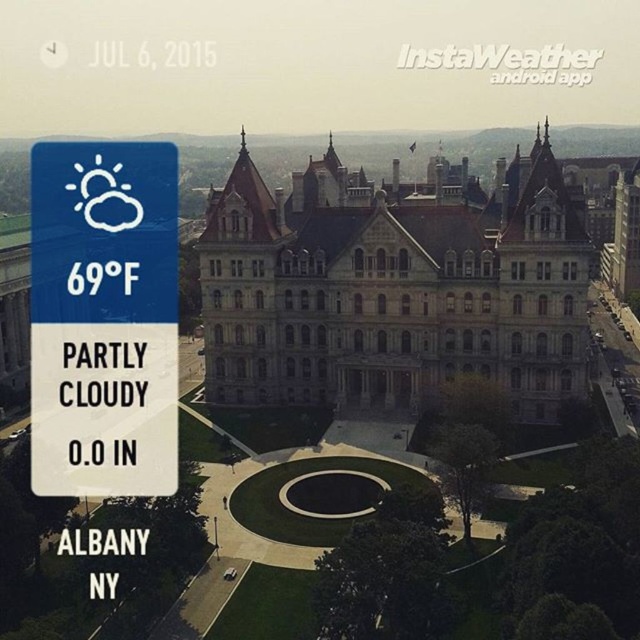
How distant is stone/brick palace at center from blue plastic weather icon at upper left?

stone/brick palace at center is 34.86 meters from blue plastic weather icon at upper left.

Between stone/brick palace at center and blue plastic weather icon at upper left, which one appears on the left side from the viewer's perspective?

Positioned to the left is blue plastic weather icon at upper left.

Is point (381, 294) more distant than point (122, 483)?

Yes, it is behind point (122, 483).

Identify the location of stone/brick palace at center. (394, 288).